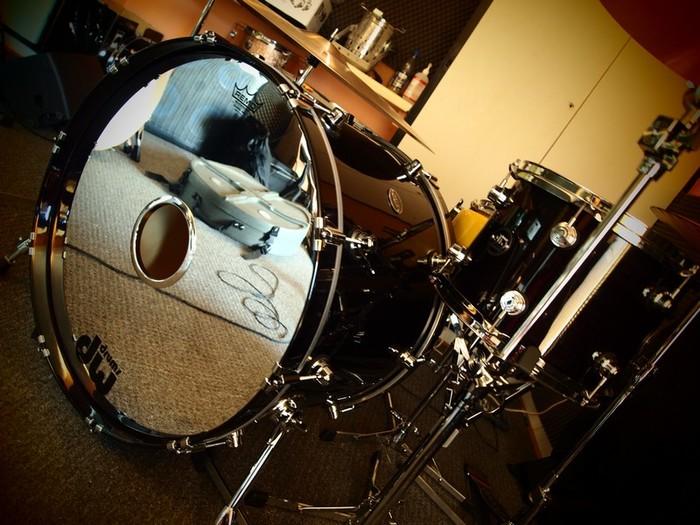
You are a GUI agent. You are given a task and a screenshot of the screen. Output one action in this format:
    pyautogui.click(x=<x>, y=<y>)
    Task: Click on the stand
    
    Given the screenshot: What is the action you would take?
    pyautogui.click(x=400, y=476)